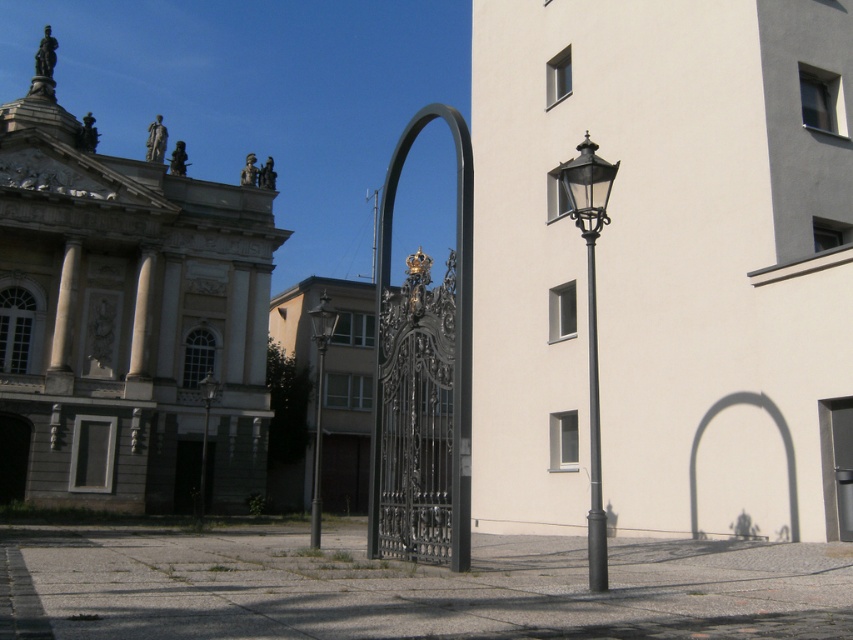
Question: Based on their relative distances, which object is farther from the matte black streetlight at center?

Choices:
 (A) matte gray door at lower left
 (B) black metal pole at center
 (C) smooth black pole at center

Answer: (B)

Question: Is matte gray door at lower left to the left of polished metal street light at center from the viewer's perspective?

Choices:
 (A) yes
 (B) no

Answer: (A)

Question: Which object is the closest to the matte gray door at lower left?

Choices:
 (A) polished metal street light at center
 (B) matte black street light at right
 (C) smooth black pole at center
 (D) black metal pole at center

Answer: (C)

Question: Can you confirm if matte gray door at lower left is positioned to the left of matte black streetlight at center?

Choices:
 (A) no
 (B) yes

Answer: (B)

Question: Which of these objects is positioned farthest from the matte gray door at lower left?

Choices:
 (A) smooth black pole at center
 (B) matte black streetlight at center

Answer: (A)

Question: Considering the relative positions of polished metal street light at center and matte black streetlight at center in the image provided, where is polished metal street light at center located with respect to matte black streetlight at center?

Choices:
 (A) left
 (B) right

Answer: (B)